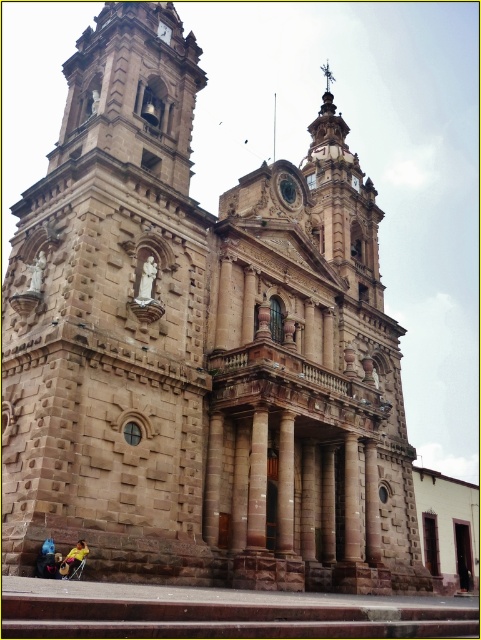
You are an architect evaluating the proportions of the church facade. Which object between the brown stone column at center and the matte brown clock at upper center is taller?

The brown stone column at center is taller than the matte brown clock at upper center.

Looking at this image, you are standing in front of the historic church and want to take a photo of the brown stone column at center and the matte brown clock at upper center. Which object should you focus on first if you want to capture both in a single frame without moving the camera?

You should focus on the brown stone column at center first because it is positioned under the matte brown clock at upper center, so adjusting the camera angle to include both would require framing from the lower to upper section.

You are standing in front of the historic church and want to take a photo that includes both the brown stone column at center and the matte brown clock at upper center. Given that your camera can capture a maximum distance of 45 meters between the closest and farthest objects in focus, will you be able to capture both objects in the same photo without moving your position?

The brown stone column at center is 46.77 meters away from the matte brown clock at upper center. Since the maximum distance your camera can handle is 45 meters, the 46.77 meters exceeds this limit. Therefore, you won t be able to capture both objects in focus without moving your position.